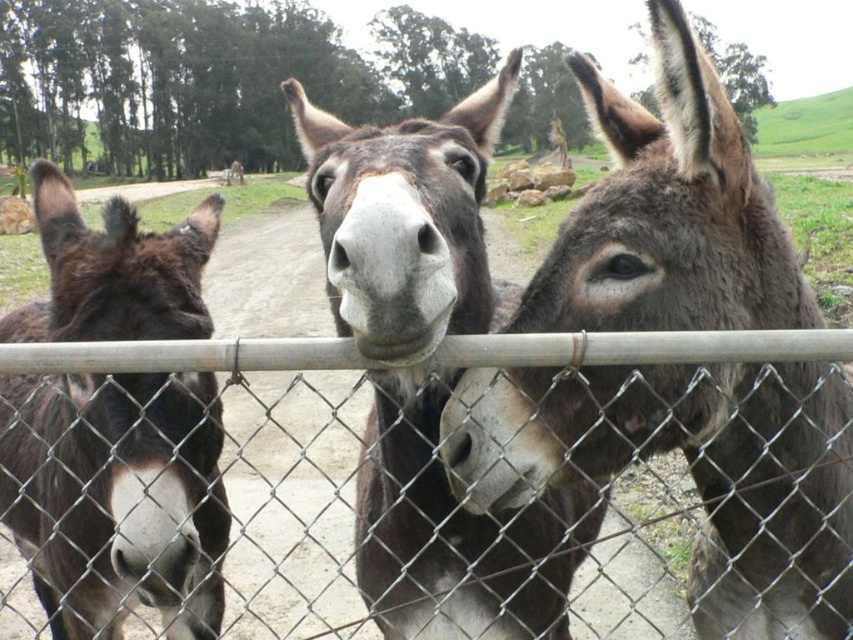
Question: Which point is farther to the camera?

Choices:
 (A) (67, 609)
 (B) (602, 348)
 (C) (299, 134)
 (D) (828, 484)

Answer: (C)

Question: Which object is closer to the camera taking this photo?

Choices:
 (A) gray matte donkey at center
 (B) metal chain-link fence at center

Answer: (A)

Question: Does dark brown fur at center have a larger size compared to dark brown fur at left?

Choices:
 (A) yes
 (B) no

Answer: (B)

Question: From the image, what is the correct spatial relationship of dark brown fur at left in relation to metal chain-link fence at center?

Choices:
 (A) above
 (B) below

Answer: (B)

Question: Can you confirm if dark brown fur at left is positioned above metal chain-link fence at center?

Choices:
 (A) yes
 (B) no

Answer: (B)

Question: Among these objects, which one is farthest from the camera?

Choices:
 (A) gray matte donkey at center
 (B) metal chain-link fence at center
 (C) dark brown fur at left
 (D) dark brown fur at center

Answer: (C)